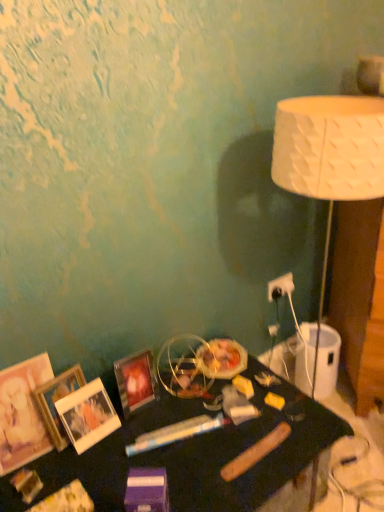
The height and width of the screenshot is (512, 384). I want to click on vacant space in front of matte glass picture frame at lower left, which is the first picture frame in right-to-left order, so tap(131, 445).